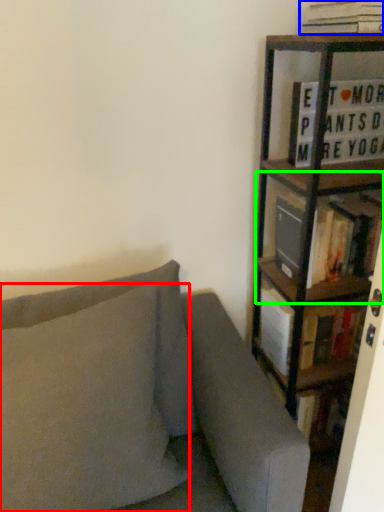
Question: Which object is the farthest from pillow (highlighted by a red box)? Choose among these: book (highlighted by a blue box) or shelf (highlighted by a green box).

Choices:
 (A) book
 (B) shelf

Answer: (A)